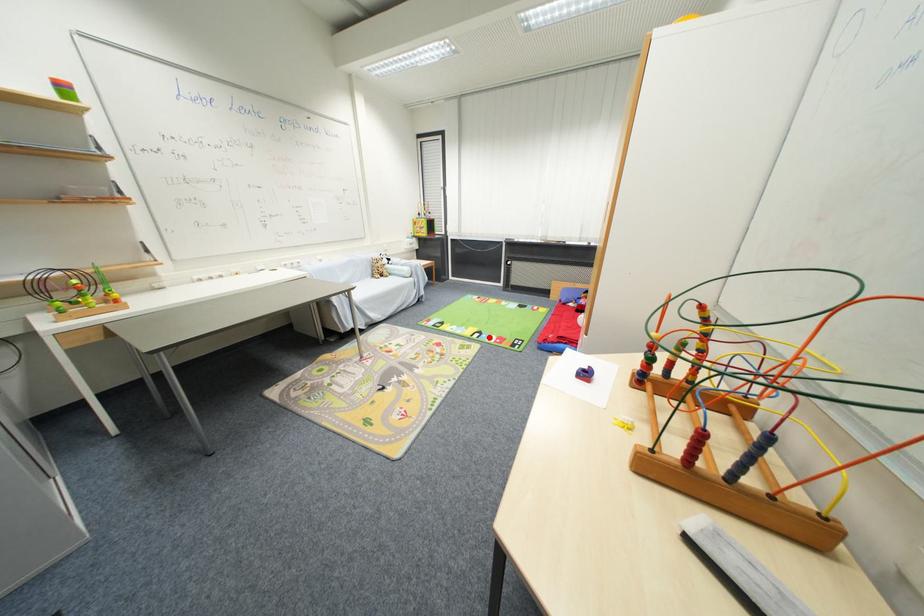
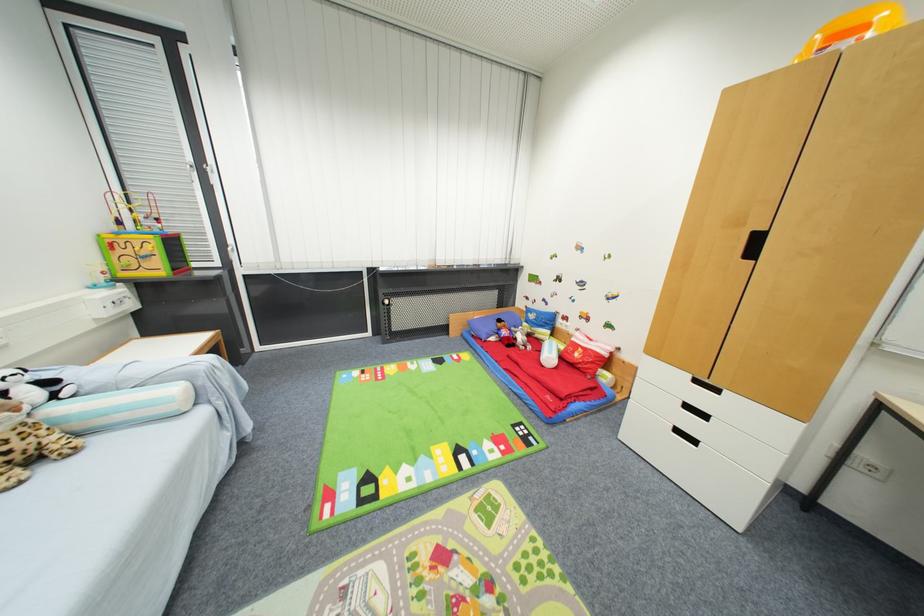
The point at the highlighted location is marked in the first image. Where is the corresponding point in the second image?

(479, 455)